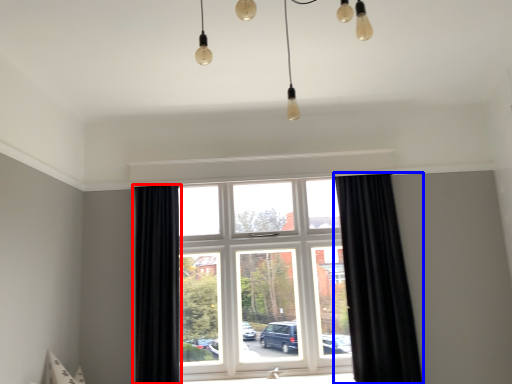
Question: Which point is closer to the camera, curtain (highlighted by a red box) or curtain (highlighted by a blue box)?

Choices:
 (A) curtain
 (B) curtain

Answer: (B)